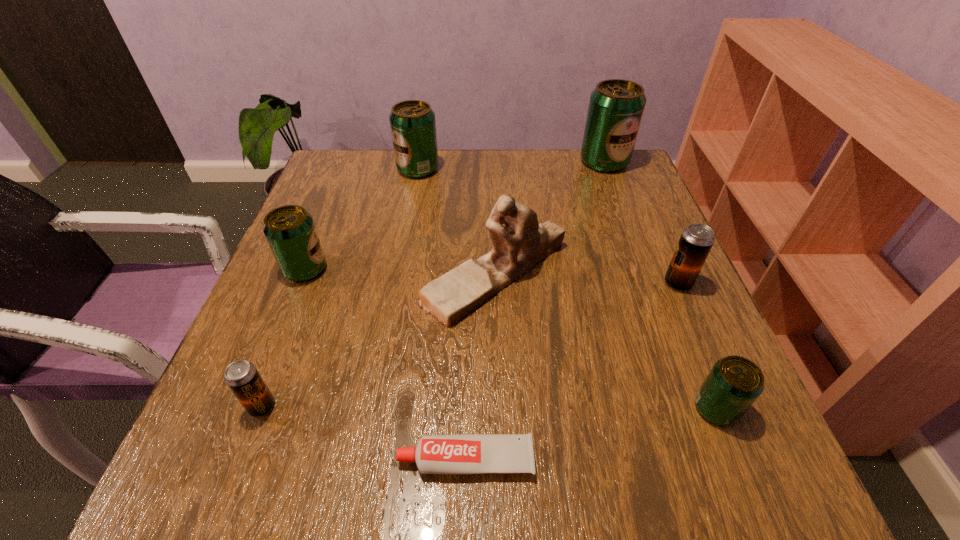
Identify the location of vacant space in between the nearest green beer can and the nearest object. (590, 434).

Identify which object is the nearest to the smallest green beer can. Please provide its 2D coordinates. Your answer should be formatted as a tuple, i.e. [(x, y)], where the tuple contains the x and y coordinates of a point satisfying the conditions above.

[(519, 242)]

This screenshot has width=960, height=540. Find the location of `object that ranks as the second closest to the second tallest beer can`. object that ranks as the second closest to the second tallest beer can is located at coordinates (290, 231).

At what (x,y) coordinates should I click in order to perform the action: click on beer can that stands as the second closest to the nearest green beer can. Please return your answer as a coordinate pair (x, y). The height and width of the screenshot is (540, 960). Looking at the image, I should click on pos(616,106).

Find the location of `beer can identified as the fourth closest to the farther black beer can`. beer can identified as the fourth closest to the farther black beer can is located at coordinates (290, 231).

This screenshot has height=540, width=960. In order to click on green beer can that is the second closest to the figurine in this screenshot , I will do `click(734, 383)`.

Locate which green beer can is the second closest to the left black beer can. Please provide its 2D coordinates. Your answer should be formatted as a tuple, i.e. [(x, y)], where the tuple contains the x and y coordinates of a point satisfying the conditions above.

[(413, 127)]

This screenshot has height=540, width=960. In order to click on vacant region that satisfies the following two spatial constraints: 1. on the back side of the third farthest green beer can; 2. on the right side of the fifth shortest beer can in this screenshot , I will do `click(346, 169)`.

Locate an element on the screen. vacant space that satisfies the following two spatial constraints: 1. on the front side of the nearest object; 2. on the left side of the second nearest green beer can is located at coordinates (228, 459).

At what (x,y) coordinates should I click in order to perform the action: click on vacant region that satisfies the following two spatial constraints: 1. on the front-facing side of the figurine; 2. on the front side of the nearer black beer can. Please return your answer as a coordinate pair (x, y). The width and height of the screenshot is (960, 540). Looking at the image, I should click on point(500,406).